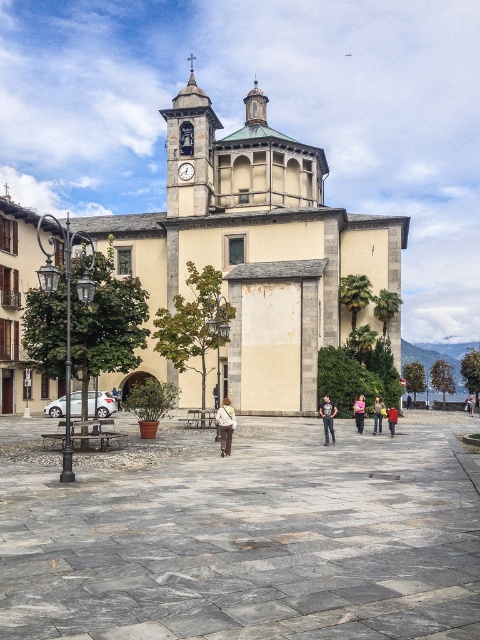
Who is positioned more to the right, yellow stone church at center or light brown leather jacket at center?

From the viewer's perspective, light brown leather jacket at center appears more on the right side.

Who is positioned more to the left, yellow stone church at center or light brown leather jacket at center?

Positioned to the left is yellow stone church at center.

Which is in front, point (177, 170) or point (379, 397)?

Positioned in front is point (379, 397).

At what (x,y) coordinates should I click in order to perform the action: click on yellow stone church at center. Please return your answer as a coordinate pair (x, y). Looking at the image, I should click on (254, 246).

Does pink fabric at center appear over brown leather jacket at center?

Correct, pink fabric at center is located above brown leather jacket at center.

Based on the photo, is pink fabric at center positioned at the back of brown leather jacket at center?

That is False.

Image resolution: width=480 pixels, height=640 pixels. What do you see at coordinates (359, 412) in the screenshot?
I see `pink fabric at center` at bounding box center [359, 412].

This screenshot has height=640, width=480. I want to click on pink fabric at center, so click(359, 412).

Locate an element on the screen. red cotton jacket at center is located at coordinates (392, 419).

Measure the distance between red cotton jacket at center and brown leather jacket at center.

red cotton jacket at center is 25.62 meters from brown leather jacket at center.

Who is more forward, (395, 410) or (116, 394)?

Point (395, 410) is more forward.

You are a GUI agent. You are given a task and a screenshot of the screen. Output one action in this format:
    pyautogui.click(x=<x>, y=<y>)
    Task: Click on the red cotton jacket at center
    Image resolution: width=480 pixels, height=640 pixels.
    Given the screenshot: What is the action you would take?
    pos(392,419)